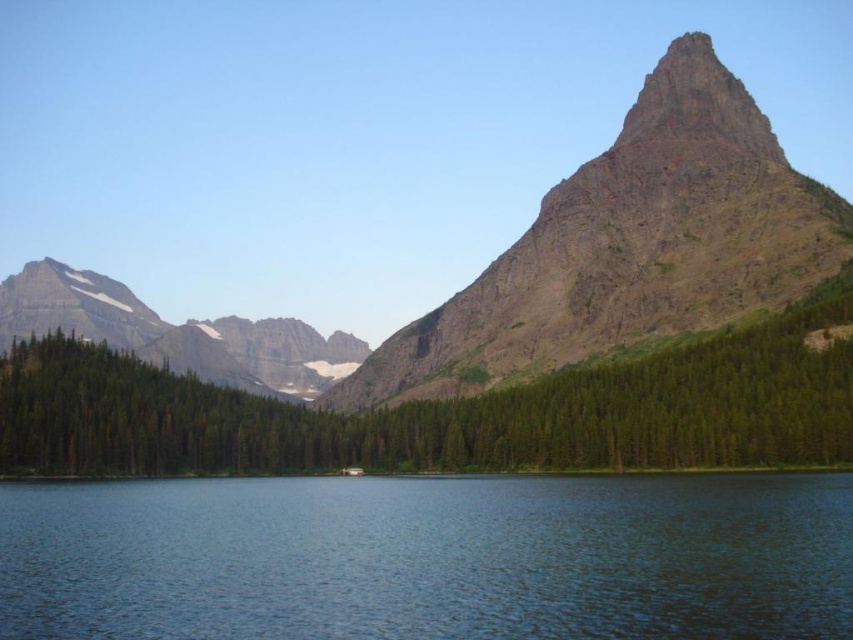
Does blue water at center have a smaller size compared to rugged granite mountain at center?

Indeed, blue water at center has a smaller size compared to rugged granite mountain at center.

Locate an element on the screen. The image size is (853, 640). blue water at center is located at coordinates (428, 557).

Is point (479, 625) behind point (714, 276)?

No, it is not.

Identify the location of blue water at center. (428, 557).

Who is more distant from viewer, (527, 429) or (583, 301)?

Point (583, 301)

Looking at this image, can you confirm if green matte forest at center is taller than rugged granite mountain at center?

No.

This screenshot has height=640, width=853. I want to click on green matte forest at center, so (x=444, y=413).

Locate an element on the screen. Image resolution: width=853 pixels, height=640 pixels. blue water at center is located at coordinates (428, 557).

Is point (590, 552) positioned after point (695, 465)?

No, (590, 552) is in front of (695, 465).

Describe the element at coordinates (428, 557) in the screenshot. I see `blue water at center` at that location.

You are a GUI agent. You are given a task and a screenshot of the screen. Output one action in this format:
    pyautogui.click(x=<x>, y=<y>)
    Task: Click on the blue water at center
    This screenshot has width=853, height=640.
    Given the screenshot: What is the action you would take?
    pyautogui.click(x=428, y=557)